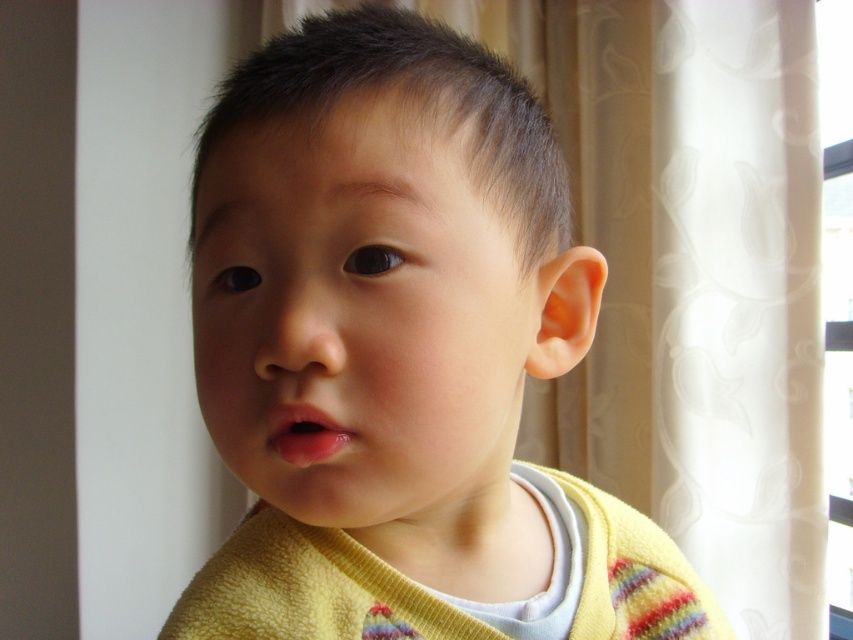
You are taking a photo of a child wearing a light yellow cardigan. The child is positioned in front of a window with sheer curtains. You want to ensure the child is in focus while the background remains slightly blurred. Given the smooth skin face at center is 10.83 inches away from the camera, can you determine if the camera settings will achieve this effect?

The smooth skin face at center is 10.83 inches away from the camera. To achieve a blurred background, the camera should be set to a wide aperture, which allows for a shallow depth of field. This setting will keep the child in focus while blurring the background. Ensure the focus is on the child and adjust the aperture accordingly.

Based on the photo, you are a photographer setting up a shot of the child. You want to ensure the yellow soft sweater at center and the transparent plastic window at upper right are both visible in the frame. Based on their positions, which object is closer to the left edge of the image?

The yellow soft sweater at center is positioned on the left side of transparent plastic window at upper right, so the yellow soft sweater at center is closer to the left edge of the image.

The child is wearing a yellow soft sweater at center and has a smooth skin face at center. Which of these two items is taller?

The yellow soft sweater at center is taller than the smooth skin face at center.